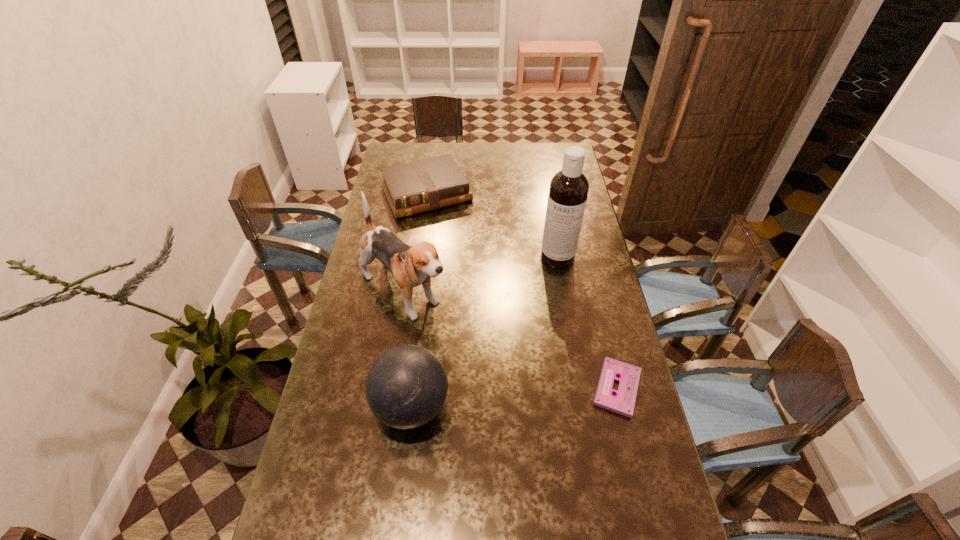
Identify the location of vacant space in between the Bible and the tallest object. (492, 225).

Locate an element on the screen. free space between the second tallest object and the Bible is located at coordinates (415, 243).

Find the location of a particular element. vacant area that lies between the videotape and the third tallest object is located at coordinates (515, 397).

You are a GUI agent. You are given a task and a screenshot of the screen. Output one action in this format:
    pyautogui.click(x=<x>, y=<y>)
    Task: Click on the unoccupied area between the shortest object and the dishwasher detergent
    
    Given the screenshot: What is the action you would take?
    pyautogui.click(x=588, y=322)

Point out which object is positioned as the nearest to the Bible. Please provide its 2D coordinates. Your answer should be formatted as a tuple, i.e. [(x, y)], where the tuple contains the x and y coordinates of a point satisfying the conditions above.

[(410, 266)]

Where is `object that can be found as the fourth closest to the bowling ball`? The image size is (960, 540). object that can be found as the fourth closest to the bowling ball is located at coordinates (418, 186).

Where is `vacant region that satisfies the following two spatial constraints: 1. on the front side of the dishwasher detergent; 2. on the left side of the shortest object`? This screenshot has width=960, height=540. vacant region that satisfies the following two spatial constraints: 1. on the front side of the dishwasher detergent; 2. on the left side of the shortest object is located at coordinates (581, 388).

This screenshot has width=960, height=540. Find the location of `free space that satisfies the following two spatial constraints: 1. on the front side of the shortest object; 2. on the right side of the second shortest object`. free space that satisfies the following two spatial constraints: 1. on the front side of the shortest object; 2. on the right side of the second shortest object is located at coordinates (398, 388).

This screenshot has height=540, width=960. In order to click on free space that satisfies the following two spatial constraints: 1. on the front side of the bowling ball; 2. on the grip area of the farthest object in this screenshot , I will do `click(396, 406)`.

Where is `vacant point that satisfies the following two spatial constraints: 1. on the front side of the fourth shortest object; 2. on the right side of the shortest object`? vacant point that satisfies the following two spatial constraints: 1. on the front side of the fourth shortest object; 2. on the right side of the shortest object is located at coordinates (388, 388).